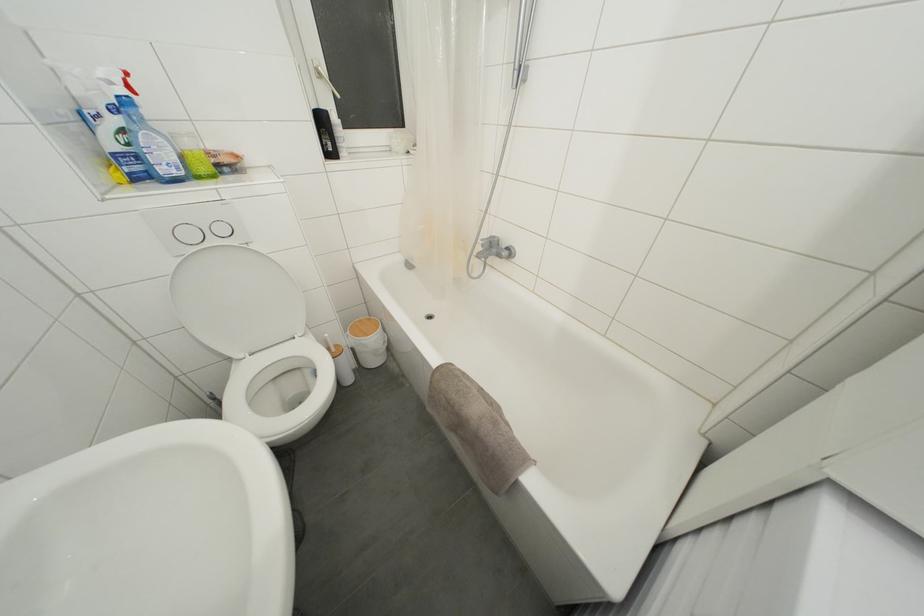
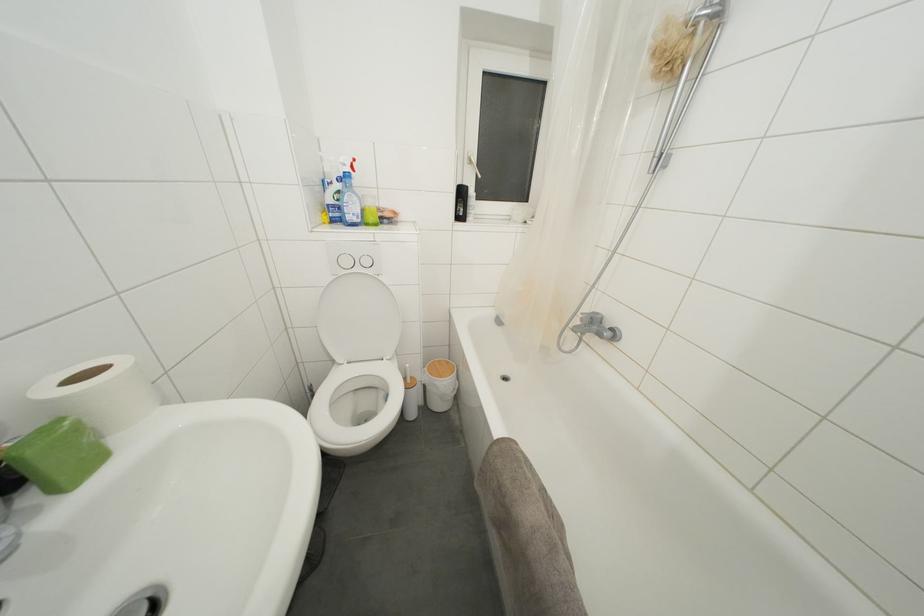
Question: The camera is either moving clockwise (left) or counter-clockwise (right) around the object. The first image is from the beginning of the video and the second image is from the end. Is the camera moving left or right when shooting the video?

Choices:
 (A) Left
 (B) Right

Answer: (B)